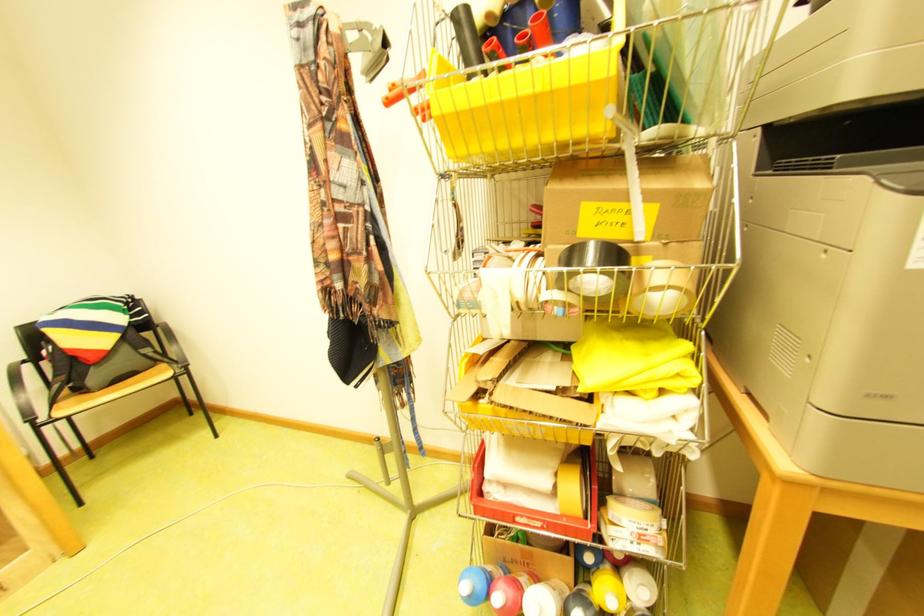
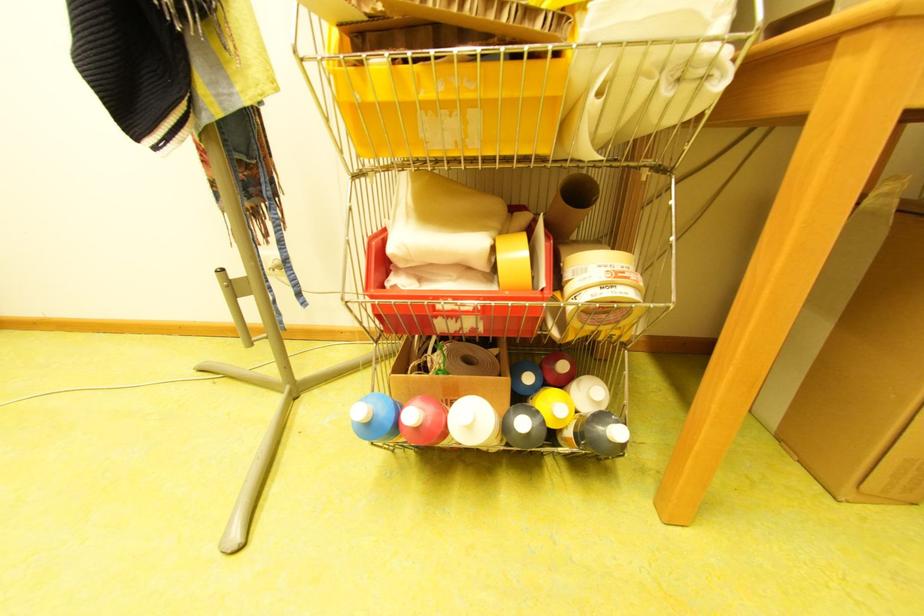
Question: The first image is from the beginning of the video and the second image is from the end. How did the camera likely rotate when shooting the video?

Choices:
 (A) Left
 (B) Right
 (C) Up
 (D) Down

Answer: (B)